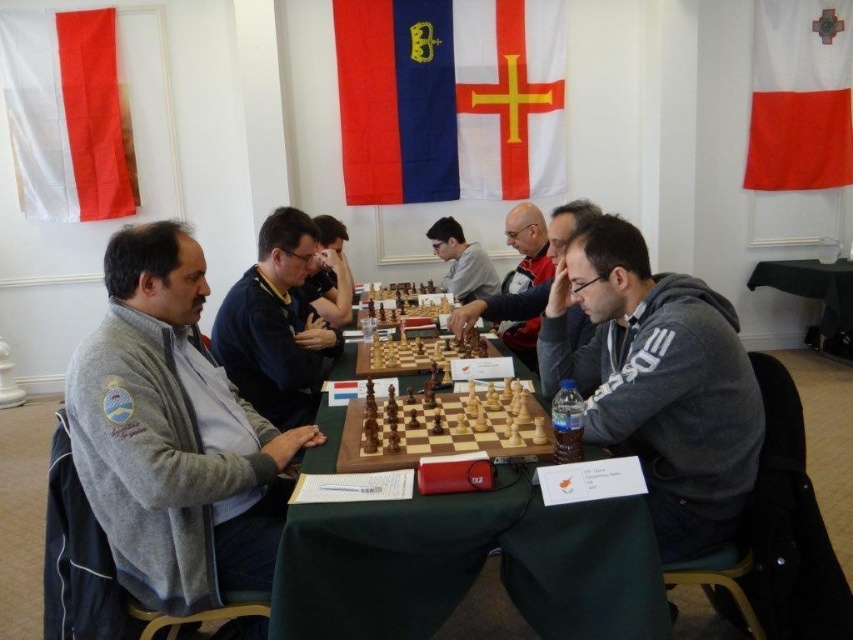
You are a photographer at the chess tournament and want to capture both the white fabric flag at upper left and the dark blue sweater at center in a single shot. Since the camera can only focus on objects within a certain distance, which object should you position closer to ensure both are in focus?

The white fabric flag at upper left is smaller than the dark blue sweater at center. To ensure both are in focus, position the white fabric flag at upper left closer to the camera since smaller objects need to be nearer to maintain focus in the same plane as larger ones.

You are a photographer at the chess tournament and want to capture a photo that includes both the white fabric flag at upper left and the dark blue sweater at center. From which side of the scene should you position yourself to ensure both objects are visible in the frame?

You should position yourself to the right side of the scene because the white fabric flag at upper left is to the left of the dark blue sweater at center, so placing yourself to the right would allow both objects to be within the camera frame.